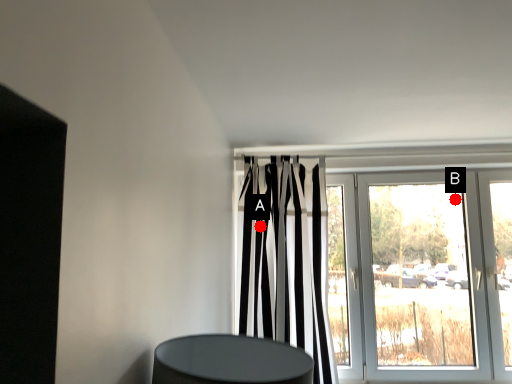
Question: Two points are circled on the image, labeled by A and B beside each circle. Which point is closer to the camera?

Choices:
 (A) A is closer
 (B) B is closer

Answer: (A)